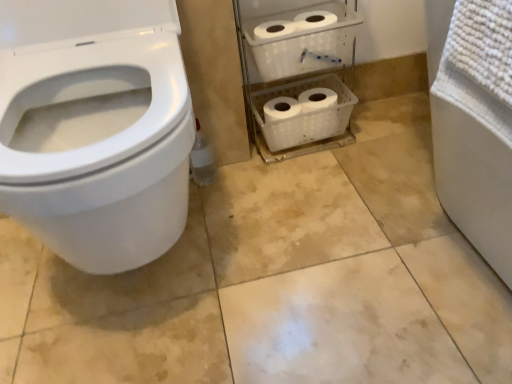
The width and height of the screenshot is (512, 384). I want to click on space that is in front of white plastic shelf at center, so click(308, 197).